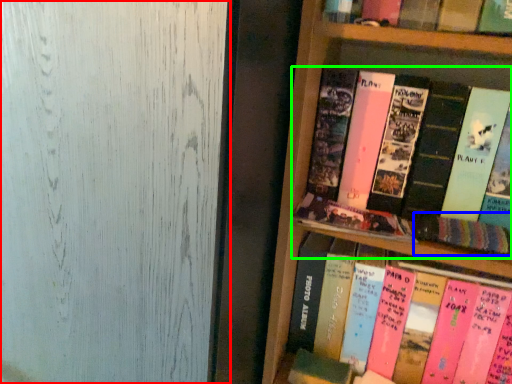
Question: Estimate the real-world distances between objects in this image. Which object is farther from glass door (highlighted by a red box), book (highlighted by a blue box) or book (highlighted by a green box)?

Choices:
 (A) book
 (B) book

Answer: (A)